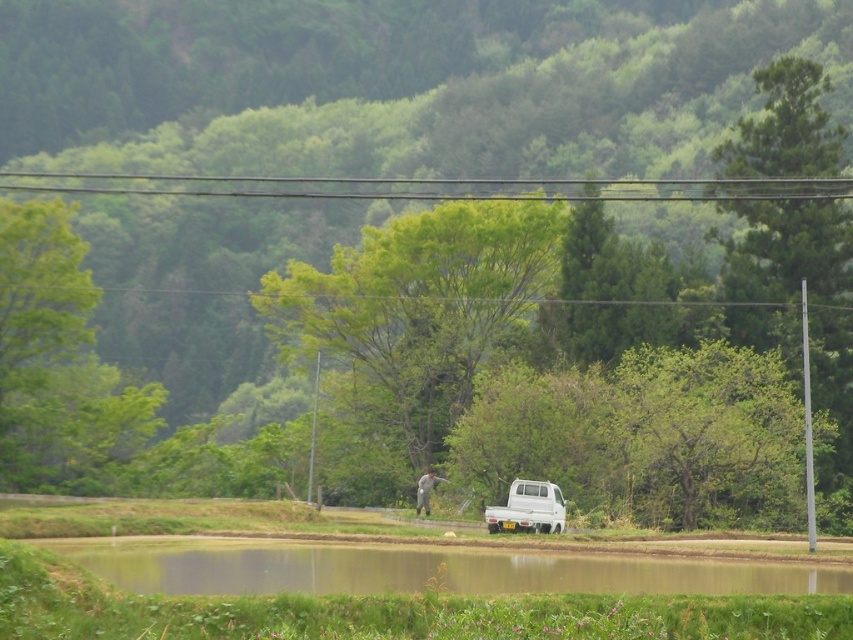
Is white matte pickup truck at center above green grassy lake at lower center?

Yes, white matte pickup truck at center is above green grassy lake at lower center.

Between white matte pickup truck at center and green grassy lake at lower center, which one appears on the left side from the viewer's perspective?

From the viewer's perspective, white matte pickup truck at center appears more on the left side.

Where is `white matte pickup truck at center`? The height and width of the screenshot is (640, 853). white matte pickup truck at center is located at coordinates (416, 308).

Between green grassy lake at lower center and smooth wire at upper center, which one has more height?

smooth wire at upper center

Can you confirm if green grassy lake at lower center is smaller than smooth wire at upper center?

Correct, green grassy lake at lower center occupies less space than smooth wire at upper center.

Is point (389, 584) closer to camera compared to point (229, 193)?

Yes, point (389, 584) is in front of point (229, 193).

The height and width of the screenshot is (640, 853). I want to click on green grassy lake at lower center, so click(x=425, y=570).

Which of these two, white matte pickup truck at center or smooth wire at upper center, stands shorter?

smooth wire at upper center

Who is positioned more to the left, white matte pickup truck at center or smooth wire at upper center?

Positioned to the left is white matte pickup truck at center.

Looking at this image, measure the distance between white matte pickup truck at center and camera.

white matte pickup truck at center is 72.32 meters from camera.

Locate an element on the screen. white matte pickup truck at center is located at coordinates (416, 308).